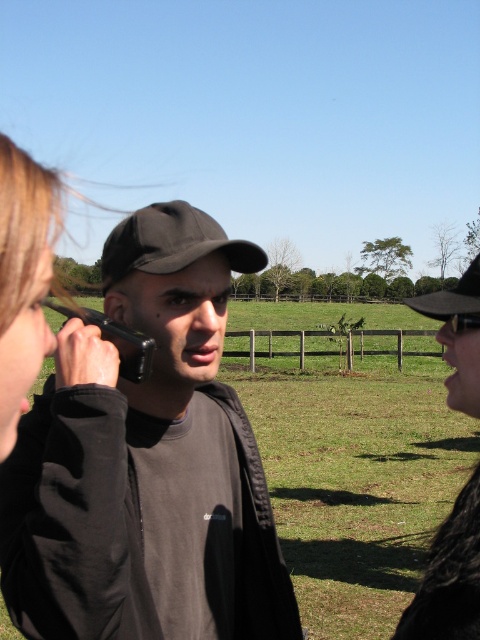
Question: Can you confirm if black textured hat at right is thinner than black matte baseball cap at upper center?

Choices:
 (A) no
 (B) yes

Answer: (B)

Question: Which point appears farthest from the camera in this image?

Choices:
 (A) (x=119, y=332)
 (B) (x=405, y=632)
 (C) (x=160, y=205)
 (D) (x=191, y=532)

Answer: (C)

Question: Does matte black cap at center lie behind black textured hat at right?

Choices:
 (A) no
 (B) yes

Answer: (B)

Question: Which point is closer to the camera?

Choices:
 (A) (433, 570)
 (B) (192, 544)

Answer: (A)

Question: Does matte black cap at center have a greater width compared to black fabric baseball cap at center?

Choices:
 (A) no
 (B) yes

Answer: (A)

Question: Which object is closer to the camera taking this photo?

Choices:
 (A) black matte baseball cap at upper center
 (B) black matte smartphone at left
 (C) matte black cap at center
 (D) black textured hat at right

Answer: (B)